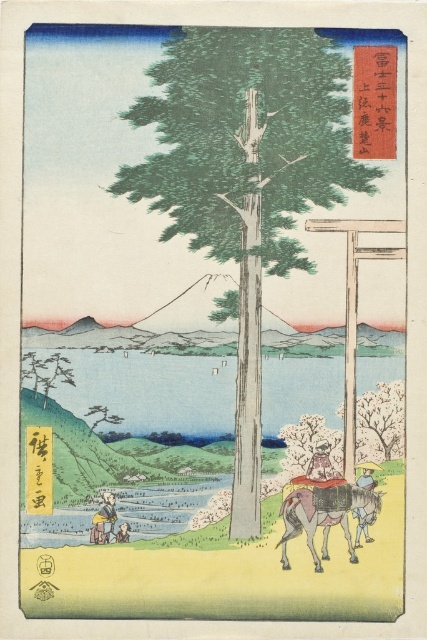
You are an artist analyzing this Japanese woodblock print. You notice two points of interest marked at coordinates point (114,506) and point (307,472). Based on the scene, which point is closer to the viewer?

Point (114,506) is closer to the viewer than point (307,472).

You are standing at the point marked by the coordinates point [46,372] in the image. Looking around, you see a green matte tree at lower left and a figure riding a donkey in the lower right corner. Which direction should you walk to reach the figure riding a donkey in the lower right corner?

The point [46,372] is on the green matte tree at lower left. To reach the figure riding a donkey in the lower right corner, you should walk towards the lower right direction from the point.

You are standing in the scene depicted in the traditional Japanese woodblock print. You want to take a photo of the brown textured donkey at lower center without including the distant Mount Fuji in the background. Is the donkey close enough to frame it in your camera without capturing the mountain?

The brown textured donkey at lower center is only 3.89 feet away from the camera. Since this distance is relatively short, you can likely frame the donkey closely enough to exclude the distant Mount Fuji in the background.